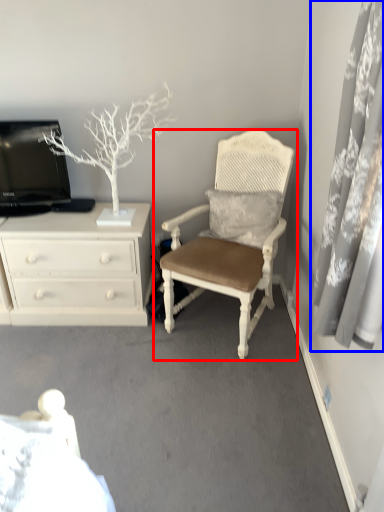
Question: Which of the following is the closest to the observer, chair (highlighted by a red box) or curtain (highlighted by a blue box)?

Choices:
 (A) chair
 (B) curtain

Answer: (B)